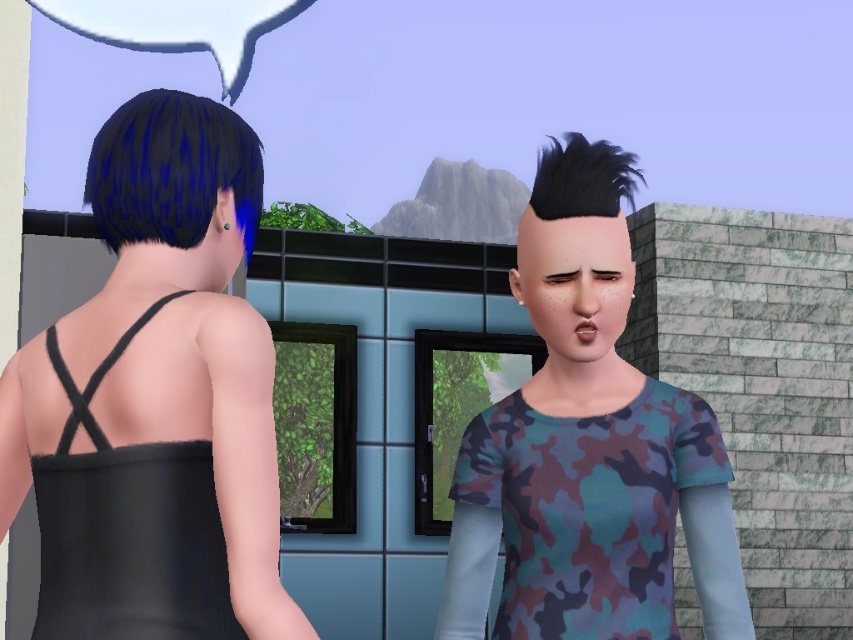
In the scene from the video game, there are two characters and a point marked at coordinates (126, 529). The characters are wearing different clothing. Which character is wearing the black matte dress located at the marked point?

The black matte dress at back is located at point (126, 529), so the character wearing it is the one with short, dark hair styled in a bob cut wearing a black sleeveless top with thin straps.

Consider the image. You are a character in The Sims game and you want to pick up the black matte dress at back. Where should you go to find it?

The black matte dress at back is located at point [126,529], so you should go to that coordinate to pick it up.

You are a photographer positioned at the camera. You want to capture a closeup of the blue shiny hair at back. Given that your camera has a minimum focusing distance of 5 feet, will you be able to achieve this closeup without moving the camera?

The blue shiny hair at back is 8.78 feet away from the camera, which is beyond the minimum focusing distance of 5 feet. Therefore, you can capture the closeup without moving the camera as the distance is sufficient.